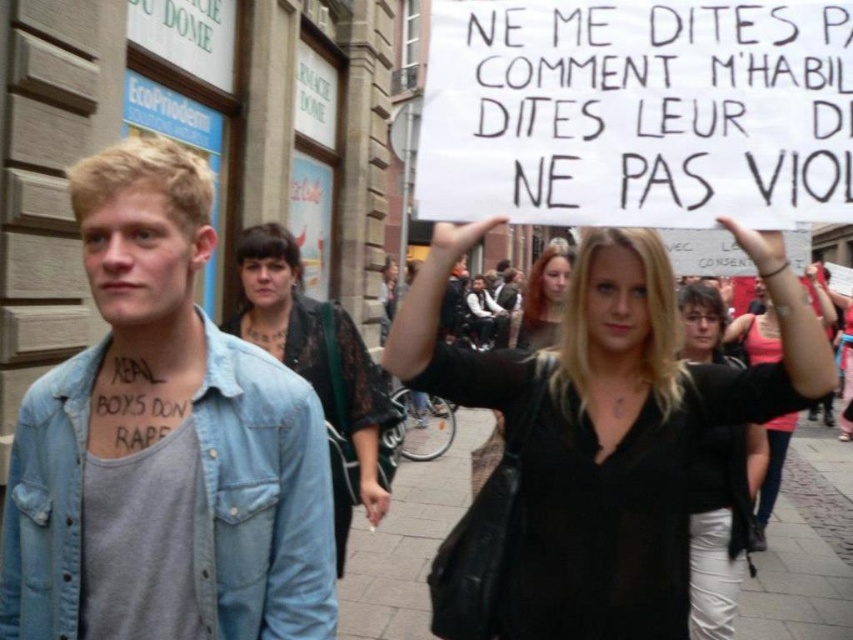
Question: Among these points, which one is farthest from the camera?

Choices:
 (A) (41, 584)
 (B) (550, 342)

Answer: (B)

Question: Does dark green lace top at center appear under black leather jacket at upper center?

Choices:
 (A) yes
 (B) no

Answer: (B)

Question: Where is black leather jacket at upper center located in relation to blonde hair at center in the image?

Choices:
 (A) above
 (B) below

Answer: (B)

Question: In this image, where is black leather jacket at center located relative to blonde hair at center?

Choices:
 (A) right
 (B) left

Answer: (B)

Question: Which point is farther to the camera?

Choices:
 (A) blonde hair at center
 (B) black leather jacket at upper center
 (C) denim jacket at left
 (D) dark green lace top at center

Answer: (A)

Question: Which point is closer to the camera?

Choices:
 (A) (532, 332)
 (B) (822, 353)
 (C) (204, 348)

Answer: (B)